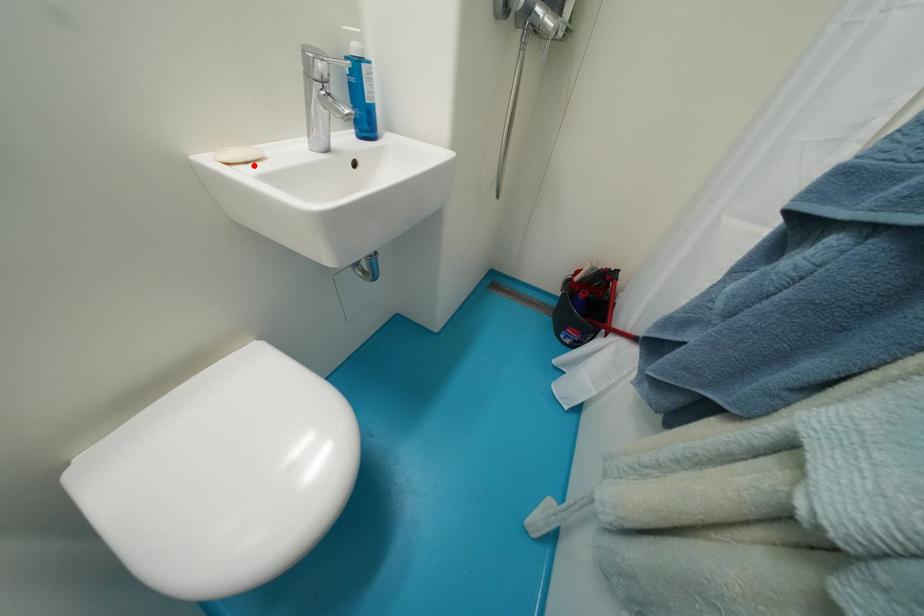
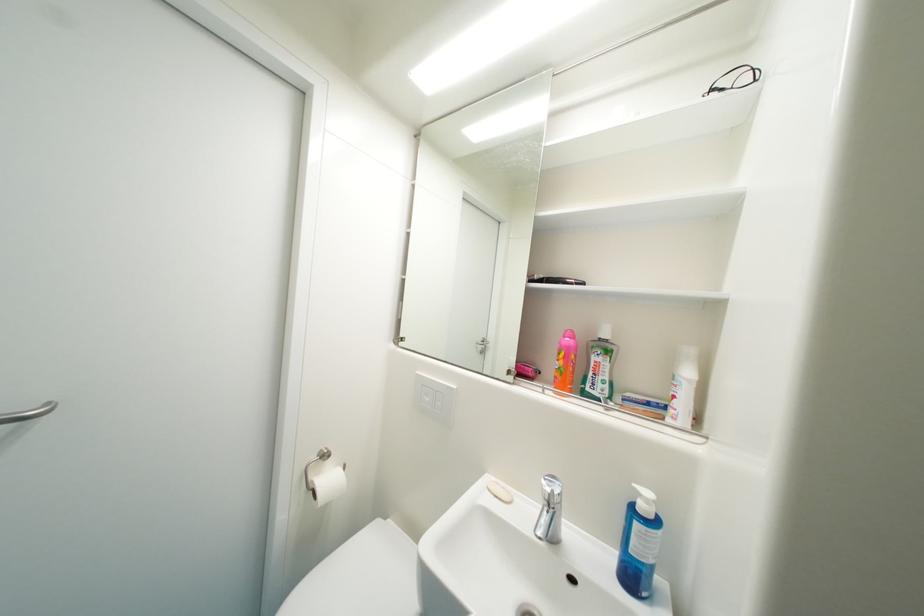
In the second image, find the point that corresponds to the highlighted location in the first image.

(503, 498)